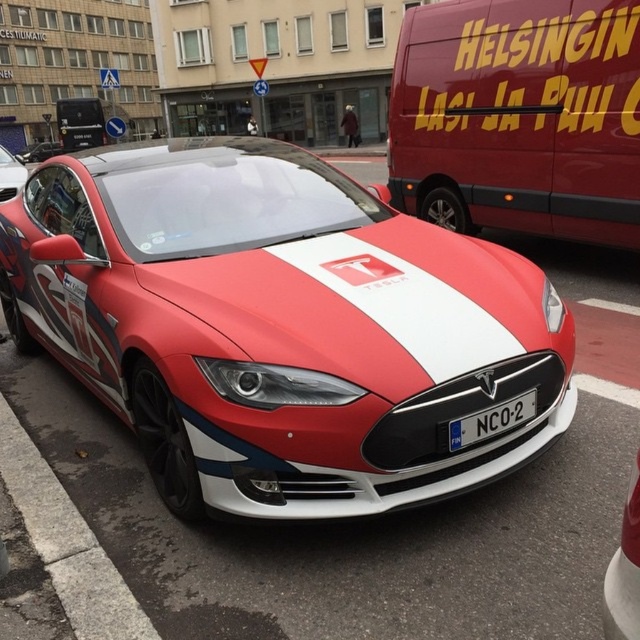
Is matte red and white tesla at center to the right of shiny red and white tesla at center from the viewer's perspective?

Indeed, matte red and white tesla at center is positioned on the right side of shiny red and white tesla at center.

Does matte red and white tesla at center have a smaller size compared to shiny red and white tesla at center?

Indeed, matte red and white tesla at center has a smaller size compared to shiny red and white tesla at center.

Identify the location of matte red and white tesla at center. (280, 326).

You are a GUI agent. You are given a task and a screenshot of the screen. Output one action in this format:
    pyautogui.click(x=<x>, y=<y>)
    Task: Click on the matte red and white tesla at center
    
    Given the screenshot: What is the action you would take?
    pyautogui.click(x=280, y=326)

Consider the image. Who is higher up, matte red van at upper right or white plastic license plate at center?

Positioned higher is matte red van at upper right.

Measure the distance between matte red van at upper right and camera.

matte red van at upper right is 3.89 meters from camera.

Locate an element on the screen. This screenshot has width=640, height=640. matte red van at upper right is located at coordinates (518, 116).

Between white plastic license plate at center and shiny red and white tesla at center, which one is positioned higher?

shiny red and white tesla at center is above.

Can you confirm if white plastic license plate at center is thinner than shiny red and white tesla at center?

Correct, white plastic license plate at center's width is less than shiny red and white tesla at center's.

Between point (452, 444) and point (52, 154), which one is positioned in front?

Point (452, 444) is more forward.

Locate an element on the screen. white plastic license plate at center is located at coordinates (492, 420).